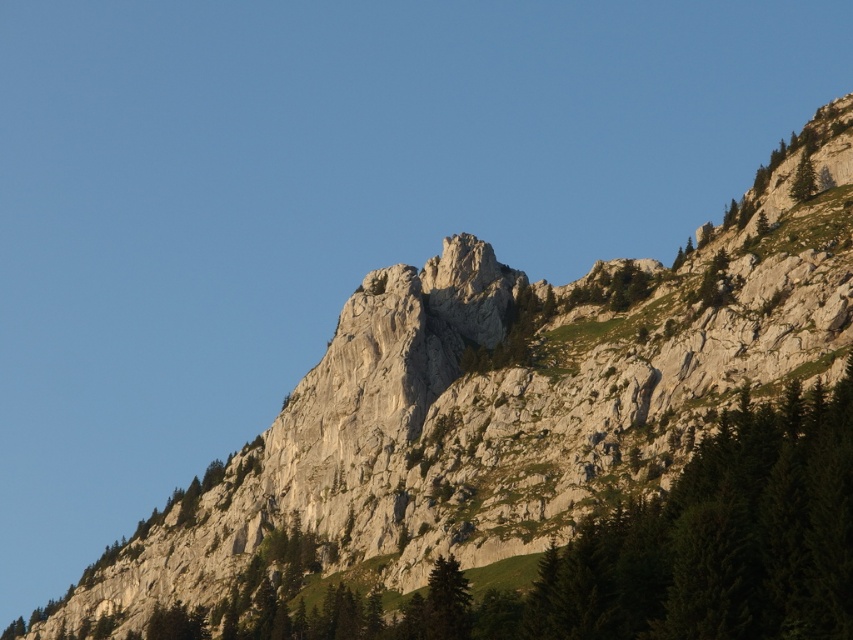
You are a hiker standing at the base of the mountain. You spot a green matte tree at lower center. If you want to reach the tree, which direction should you move relative to your current position?

The green matte tree at lower center is located at point coordinates (445,602). Since you are at the base of the mountain, moving towards the lower center direction will lead you to the tree.

You are a hiker planning to set up a tent between the green matte tree at lower center and the green textured tree at upper right. Considering their widths, which tree would allow for more space around the tent?

The green textured tree at upper right has a greater width than the green matte tree at lower center, so setting up the tent near it would provide more space around the tent.

In the scene shown: You are a mountaineer planning to reach a specific point on the mountain. The point is located at coordinates point (x=451, y=570). Given that your current position is 100 meters away from the camera, can you safely approach this point without getting too close?

The distance of point (x=451, y=570) from camera is 92.76 meters. Since your current position is 100 meters away from the camera, you are 7.24 meters away from the point. This distance may be safe depending on the terrain, but you should proceed with caution considering the rugged mountain landscape described.